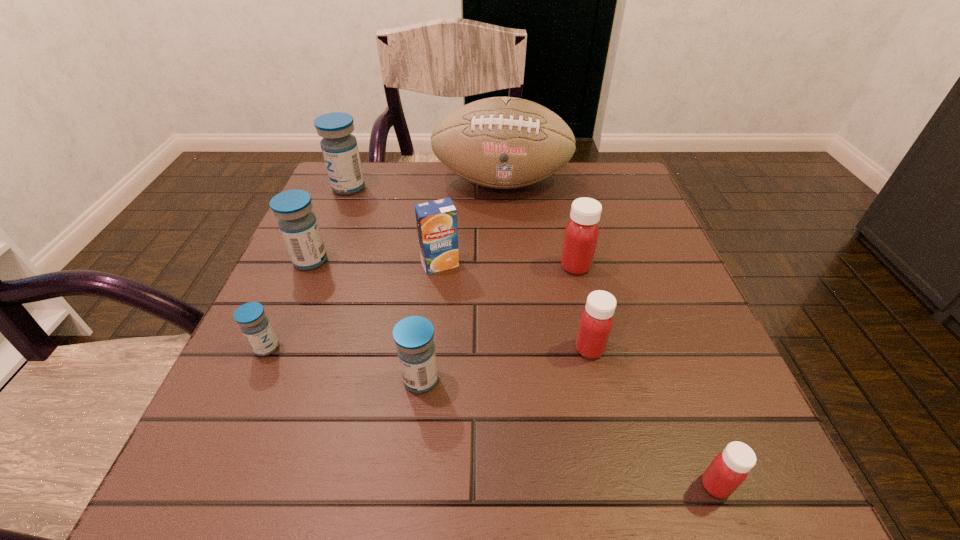
In order to click on the nearest object in this screenshot , I will do `click(729, 469)`.

This screenshot has width=960, height=540. I want to click on the nearest red medicine, so click(x=729, y=469).

This screenshot has height=540, width=960. Identify the location of free location located on the laces of the football (American). (508, 280).

Image resolution: width=960 pixels, height=540 pixels. Identify the location of vacant space located on the right of the farthest medicine. (483, 188).

What are the coordinates of `free location located 0.050m on the left of the biggest red medicine` in the screenshot? It's located at (536, 266).

I want to click on vacant region located 0.060m on the back of the second farthest blue medicine, so click(x=323, y=233).

The image size is (960, 540). Identify the location of free space located 0.400m on the right of the blue orange_juice. (652, 264).

I want to click on vacant area situated on the back of the second smallest red medicine, so click(x=573, y=275).

This screenshot has width=960, height=540. I want to click on blank space located 0.100m on the right of the sixth farthest medicine, so click(501, 380).

The height and width of the screenshot is (540, 960). Find the location of `vacant space situated 0.210m on the right of the second nearest blue medicine`. vacant space situated 0.210m on the right of the second nearest blue medicine is located at coordinates (401, 348).